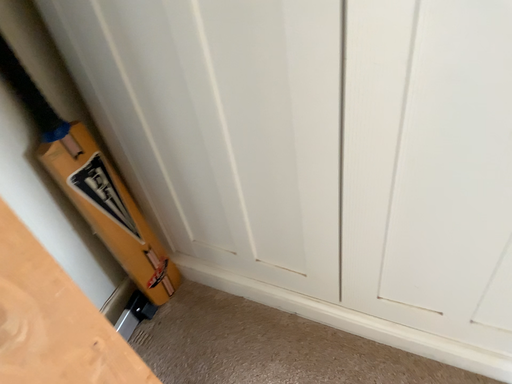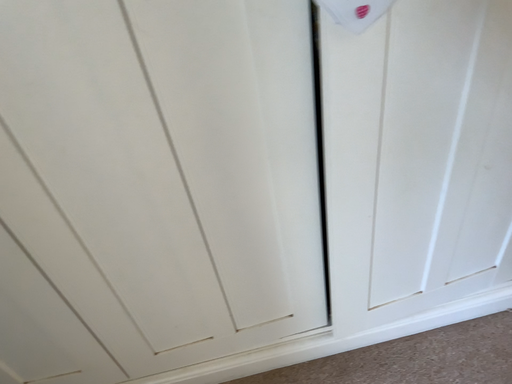
Question: How did the camera likely rotate when shooting the video?

Choices:
 (A) rotated right
 (B) rotated left

Answer: (A)